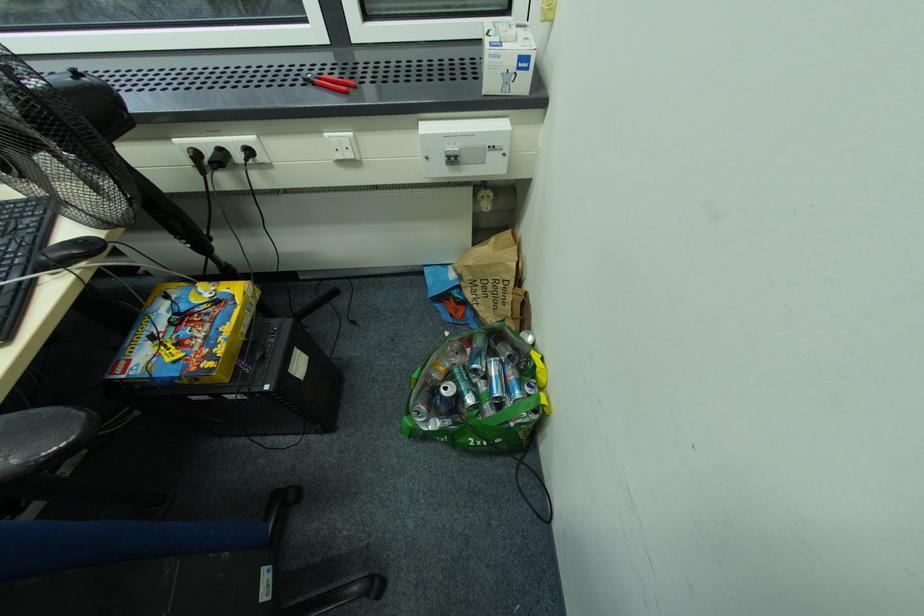
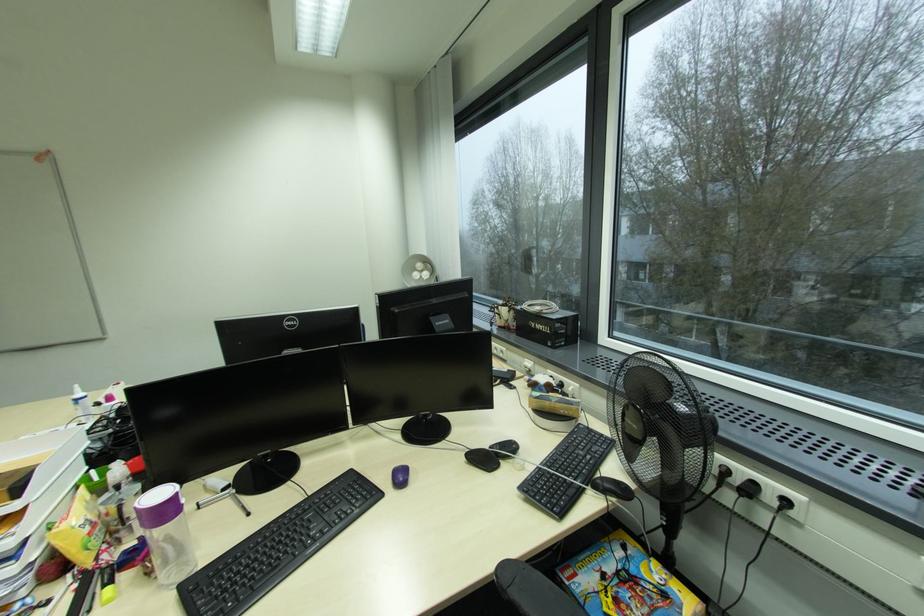
The point at (x=180, y=298) is marked in the first image. Where is the corresponding point in the second image?

(637, 554)